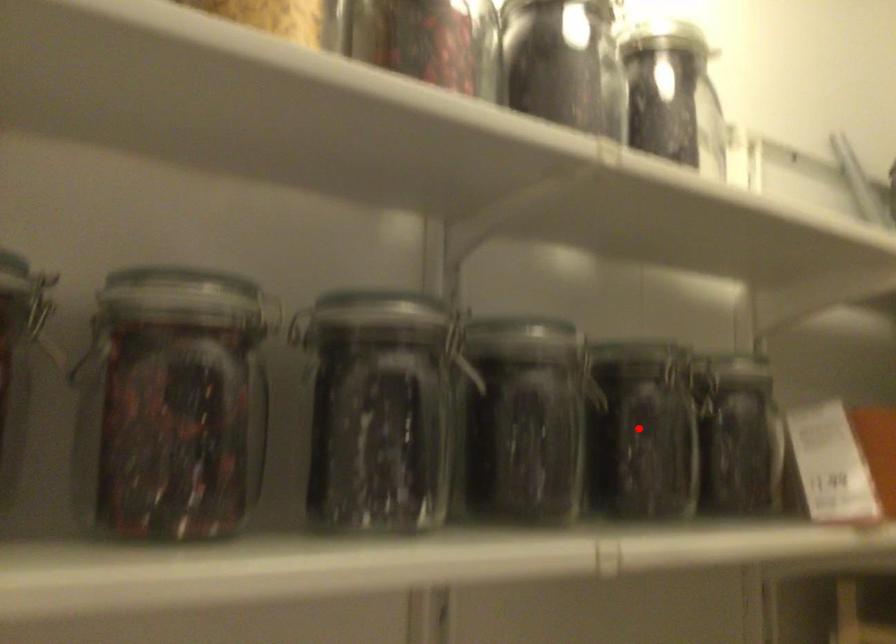
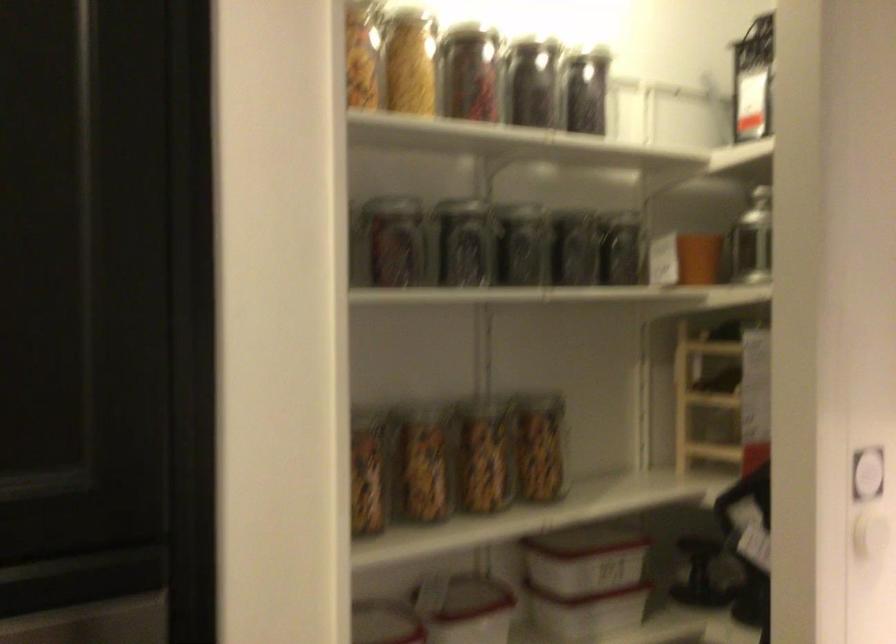
Question: I am providing you with two images of the same scene from different viewpoints. Given a red point in image1, look at the same physical point in image2. Is it:

Choices:
 (A) Closer to the viewpoint
 (B) Farther from the viewpoint

Answer: (B)